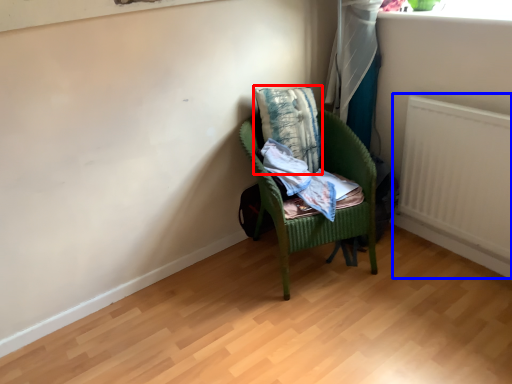
Question: Which point is closer to the camera, pillow (highlighted by a red box) or radiator (highlighted by a blue box)?

Choices:
 (A) pillow
 (B) radiator

Answer: (B)